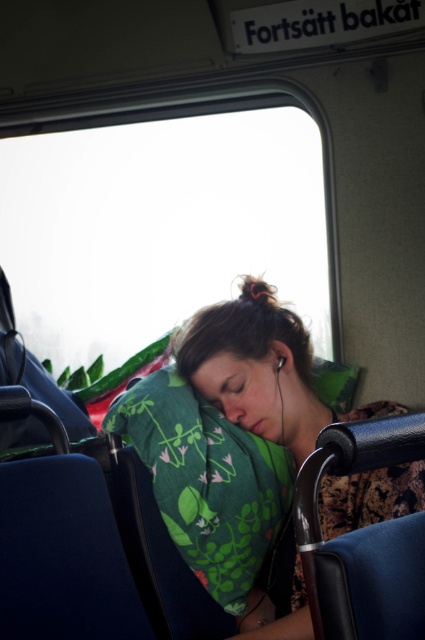
Does point (90, 380) lie in front of point (198, 401)?

No.

Locate an element on the screen. The width and height of the screenshot is (425, 640). transparent glass window at upper center is located at coordinates (166, 221).

Is green floral pillow at center below green fabric pillow at center?

Incorrect, green floral pillow at center is not positioned below green fabric pillow at center.

Describe the element at coordinates (255, 368) in the screenshot. The height and width of the screenshot is (640, 425). I see `green floral pillow at center` at that location.

Locate an element on the screen. green floral pillow at center is located at coordinates (255, 368).

Between transparent glass window at upper center and green floral pillow at center, which one is positioned higher?

transparent glass window at upper center is above.

Is the position of transparent glass window at upper center less distant than that of green floral pillow at center?

That is False.

Who is more forward, (159,308) or (323,419)?

Point (323,419)

Image resolution: width=425 pixels, height=640 pixels. Identify the location of transparent glass window at upper center. (166, 221).